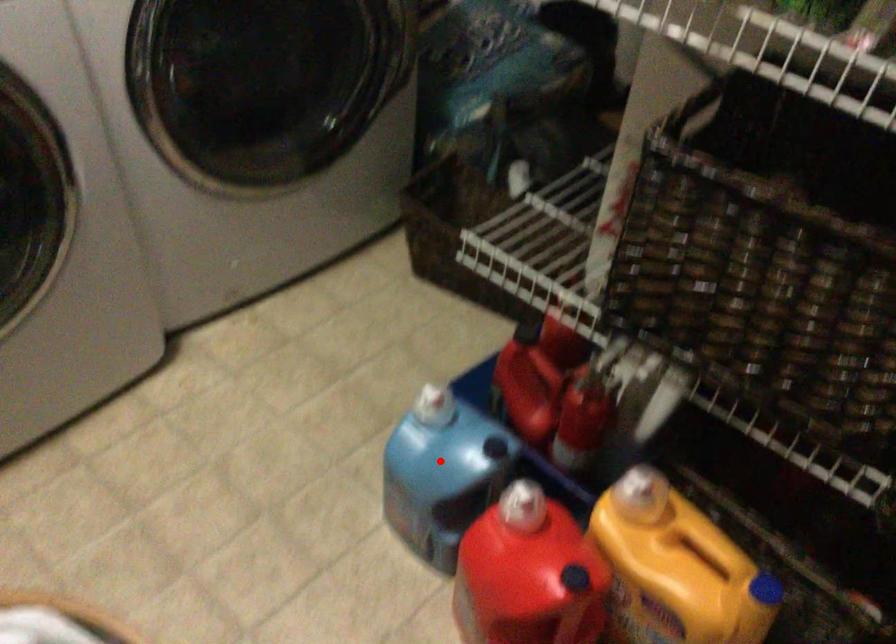
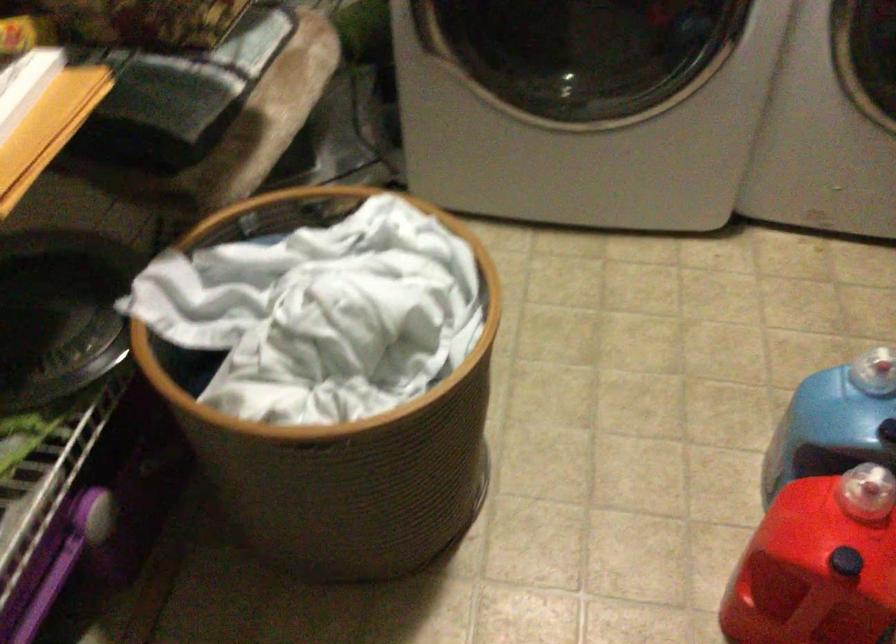
Locate, in the second image, the point that corresponds to the highlighted location in the first image.

(839, 418)